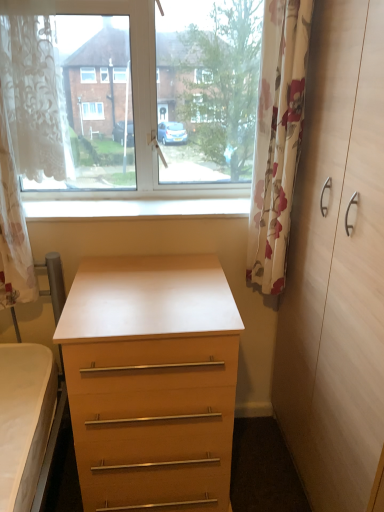
The image size is (384, 512). What do you see at coordinates (135, 129) in the screenshot?
I see `transparent glass window at upper center` at bounding box center [135, 129].

At what (x,y) coordinates should I click in order to perform the action: click on transparent glass window at upper center. Please return your answer as a coordinate pair (x, y). The height and width of the screenshot is (512, 384). Looking at the image, I should click on (135, 129).

Describe the element at coordinates (151, 381) in the screenshot. The width and height of the screenshot is (384, 512). I see `matte wood chest of drawers at center` at that location.

Identify the location of matte wood chest of drawers at center. Image resolution: width=384 pixels, height=512 pixels. (151, 381).

What do you see at coordinates (277, 142) in the screenshot? The height and width of the screenshot is (512, 384). I see `floral fabric curtain at right, arranged as the second curtain when viewed from the left` at bounding box center [277, 142].

Where is `transparent glass window at upper center`? transparent glass window at upper center is located at coordinates (135, 129).

From a real-world perspective, is floral fabric curtain at right, arranged as the second curtain when viewed from the left, physically above matte wood chest of drawers at center?

Yes.

From the image's perspective, which is below, floral fabric curtain at right, which is the 1th curtain from right to left, or matte wood chest of drawers at center?

matte wood chest of drawers at center, from the image's perspective.

Could light wood dresser at right be considered to be inside white lace curtain at left, which is the 2th curtain from right to left?

No.

Based on their positions, is white lace curtain at left, which is the 2th curtain from right to left, located to the left or right of light wood dresser at right?

Based on their positions, white lace curtain at left, which is the 2th curtain from right to left, is located to the left of light wood dresser at right.

In terms of size, does white lace curtain at left, which is the 2th curtain from right to left, appear bigger or smaller than light wood dresser at right?

white lace curtain at left, which is the 2th curtain from right to left, is smaller than light wood dresser at right.

Considering the positions of objects white lace curtain at left, the first curtain positioned from the left, and floral fabric curtain at right, arranged as the second curtain when viewed from the left, in the image provided, who is in front, white lace curtain at left, the first curtain positioned from the left, or floral fabric curtain at right, arranged as the second curtain when viewed from the left,?

white lace curtain at left, the first curtain positioned from the left, is more forward.

Based on the photo, considering the sizes of objects white lace curtain at left, which is the 2th curtain from right to left, and floral fabric curtain at right, arranged as the second curtain when viewed from the left, in the image provided, who is wider, white lace curtain at left, which is the 2th curtain from right to left, or floral fabric curtain at right, arranged as the second curtain when viewed from the left,?

With larger width is white lace curtain at left, which is the 2th curtain from right to left.

Between white lace curtain at left, which is the 2th curtain from right to left, and floral fabric curtain at right, which is the 1th curtain from right to left, which one has smaller size?

floral fabric curtain at right, which is the 1th curtain from right to left, is smaller.

Considering the relative sizes of white lace curtain at left, the first curtain positioned from the left, and floral fabric curtain at right, arranged as the second curtain when viewed from the left, in the image provided, is white lace curtain at left, the first curtain positioned from the left, shorter than floral fabric curtain at right, arranged as the second curtain when viewed from the left,?

Correct, white lace curtain at left, the first curtain positioned from the left, is not as tall as floral fabric curtain at right, arranged as the second curtain when viewed from the left.

What's the angular difference between transparent glass window at upper center and white smooth window sill at center's facing directions?

The facing directions of transparent glass window at upper center and white smooth window sill at center are 0.00127 degrees apart.

Is transparent glass window at upper center outside of white smooth window sill at center?

transparent glass window at upper center is positioned outside white smooth window sill at center.

Is transparent glass window at upper center taller than white smooth window sill at center?

Correct, transparent glass window at upper center is much taller as white smooth window sill at center.

Is matte wood chest of drawers at center not close to light wood dresser at right?

No, matte wood chest of drawers at center is in close proximity to light wood dresser at right.

Who is bigger, matte wood chest of drawers at center or light wood dresser at right?

light wood dresser at right is bigger.

Based on their positions, is matte wood chest of drawers at center located to the left or right of light wood dresser at right?

In the image, matte wood chest of drawers at center appears on the left side of light wood dresser at right.

In terms of size, does white smooth window sill at center appear bigger or smaller than transparent glass window at upper center?

Clearly, white smooth window sill at center is smaller in size than transparent glass window at upper center.

Between white smooth window sill at center and transparent glass window at upper center, which one is positioned behind?

white smooth window sill at center is further from the camera.

Which of these two, white smooth window sill at center or transparent glass window at upper center, is thinner?

Thinner between the two is transparent glass window at upper center.

Would you consider white smooth window sill at center to be distant from transparent glass window at upper center?

That's not correct — white smooth window sill at center is a little close to transparent glass window at upper center.

Identify the location of curtain on the right of the transparent glass window at upper center. This screenshot has height=512, width=384. (277, 142).

Is transparent glass window at upper center not inside floral fabric curtain at right, arranged as the second curtain when viewed from the left?

transparent glass window at upper center is positioned outside floral fabric curtain at right, arranged as the second curtain when viewed from the left.

Considering their positions, is transparent glass window at upper center located in front of or behind floral fabric curtain at right, arranged as the second curtain when viewed from the left?

transparent glass window at upper center is positioned farther from the viewer than floral fabric curtain at right, arranged as the second curtain when viewed from the left.

The height and width of the screenshot is (512, 384). In order to click on the chest of drawers located underneath the floral fabric curtain at right, which is the 1th curtain from right to left (from a real-world perspective) in this screenshot , I will do `click(151, 381)`.

Identify the location of dresser lying below the white lace curtain at left, the first curtain positioned from the left (from the image's perspective). (337, 266).

Considering their positions, is light wood dresser at right positioned further to transparent glass window at upper center than matte wood chest of drawers at center?

light wood dresser at right is positioned further to the anchor transparent glass window at upper center.

Based on their spatial positions, is white smooth window sill at center or white lace curtain at left, which is the 2th curtain from right to left, closer to light wood dresser at right?

white smooth window sill at center is closer to light wood dresser at right.

Based on their spatial positions, is white lace curtain at left, which is the 2th curtain from right to left, or white smooth window sill at center further from transparent glass window at upper center?

white lace curtain at left, which is the 2th curtain from right to left.

When comparing their distances from floral fabric curtain at right, arranged as the second curtain when viewed from the left, does white smooth window sill at center or white lace curtain at left, which is the 2th curtain from right to left, seem closer?

Among the two, white smooth window sill at center is located nearer to floral fabric curtain at right, arranged as the second curtain when viewed from the left.

From the image, which object appears to be nearer to white lace curtain at left, the first curtain positioned from the left, light wood dresser at right or floral fabric curtain at right, which is the 1th curtain from right to left?

floral fabric curtain at right, which is the 1th curtain from right to left, is closer to white lace curtain at left, the first curtain positioned from the left.

Considering their positions, is white smooth window sill at center positioned further to white lace curtain at left, which is the 2th curtain from right to left, than floral fabric curtain at right, which is the 1th curtain from right to left?

floral fabric curtain at right, which is the 1th curtain from right to left, is further to white lace curtain at left, which is the 2th curtain from right to left.

Considering their positions, is floral fabric curtain at right, arranged as the second curtain when viewed from the left, positioned closer to light wood dresser at right than white smooth window sill at center?

The object closer to light wood dresser at right is floral fabric curtain at right, arranged as the second curtain when viewed from the left.

Looking at the image, which one is located further to light wood dresser at right, floral fabric curtain at right, which is the 1th curtain from right to left, or transparent glass window at upper center?

transparent glass window at upper center lies further to light wood dresser at right than the other object.

The image size is (384, 512). In order to click on window sill between white lace curtain at left, which is the 2th curtain from right to left, and floral fabric curtain at right, which is the 1th curtain from right to left in this screenshot , I will do tap(143, 205).

Where is `window positioned between white lace curtain at left, the first curtain positioned from the left, and white smooth window sill at center from near to far`? window positioned between white lace curtain at left, the first curtain positioned from the left, and white smooth window sill at center from near to far is located at coordinates (135, 129).

In order to click on window located between white lace curtain at left, which is the 2th curtain from right to left, and floral fabric curtain at right, which is the 1th curtain from right to left, in the left-right direction in this screenshot , I will do `click(135, 129)`.

Find the location of a particular element. Image resolution: width=384 pixels, height=512 pixels. curtain located between transparent glass window at upper center and light wood dresser at right in the left-right direction is located at coordinates (277, 142).